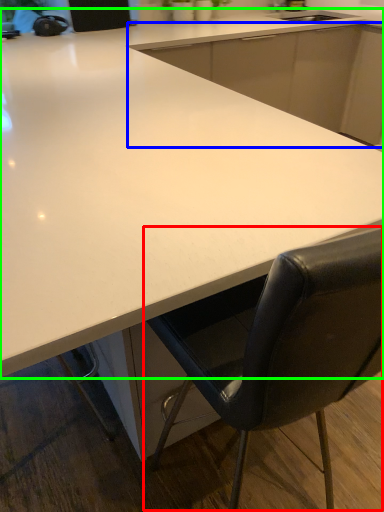
Question: Which object is positioned farthest from chair (highlighted by a red box)? Select from cabinetry (highlighted by a blue box) and countertop (highlighted by a green box).

Choices:
 (A) cabinetry
 (B) countertop

Answer: (A)